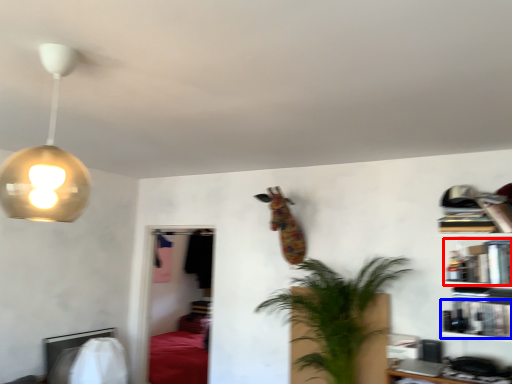
Question: Which of the following is the farthest to the observer, book (highlighted by a red box) or book (highlighted by a blue box)?

Choices:
 (A) book
 (B) book

Answer: (A)